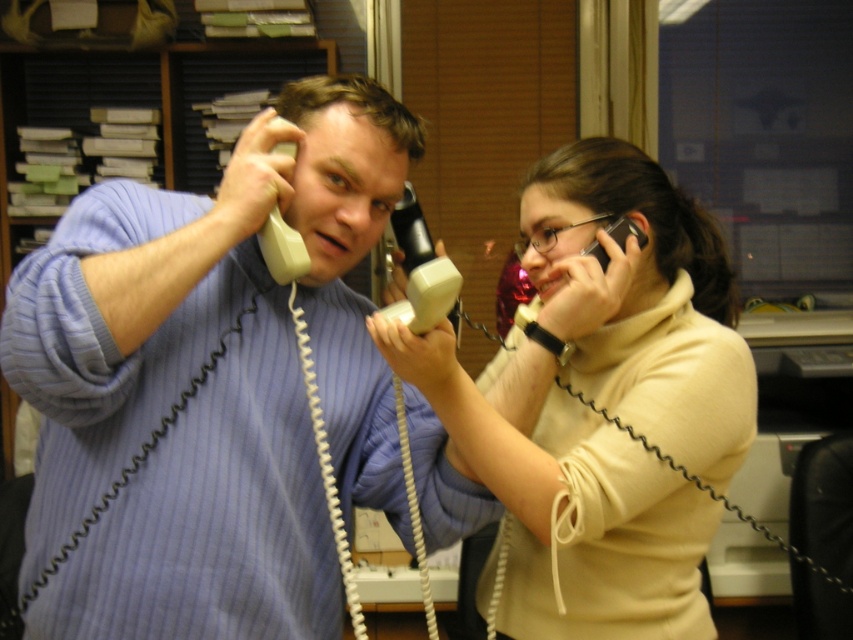
You are an office worker who needs to hang up the black plastic phone at upper right. To do so, you must first reach it. Given that the matte blue sweater at center is in your way, is the phone above or below the sweater?

The matte blue sweater at center is located below the black plastic phone at upper right, so the phone is above the sweater. Therefore, you can reach the phone by moving upwards from the sweater.

You are an office assistant who needs to place the matte blue sweater at center and the black plastic phone at upper right on a shelf. The shelf can only hold items that are smaller than 1 meter in height. Can both items fit on the shelf?

The matte blue sweater at center has a larger size compared to black plastic phone at upper right, but since the shelf can hold items smaller than 1 meter in height, both items can fit as long as their individual heights are under the limit. However, the description only provides a size comparison between them, not their exact dimensions. Without knowing the exact height of the sweater, it is uncertain if it meets the shelf requirement.